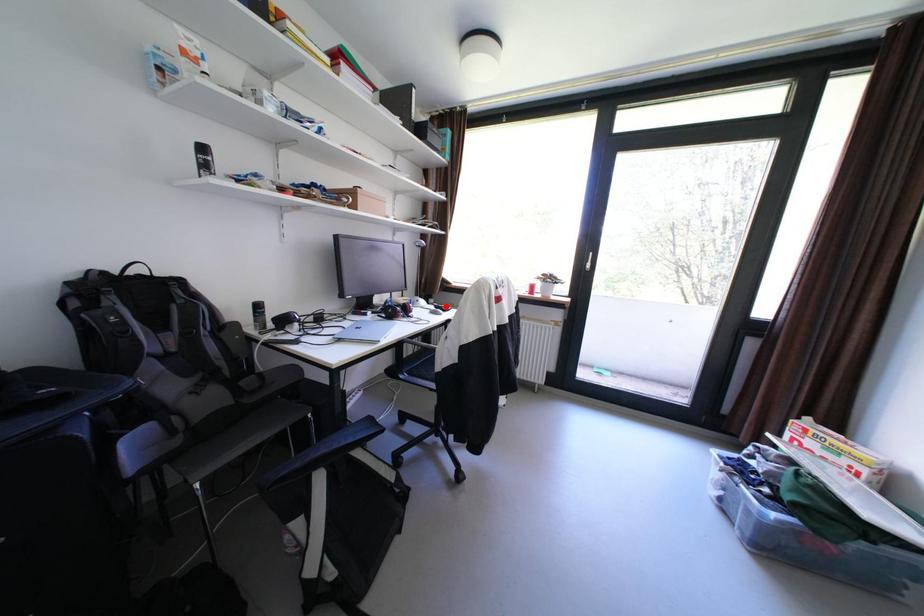
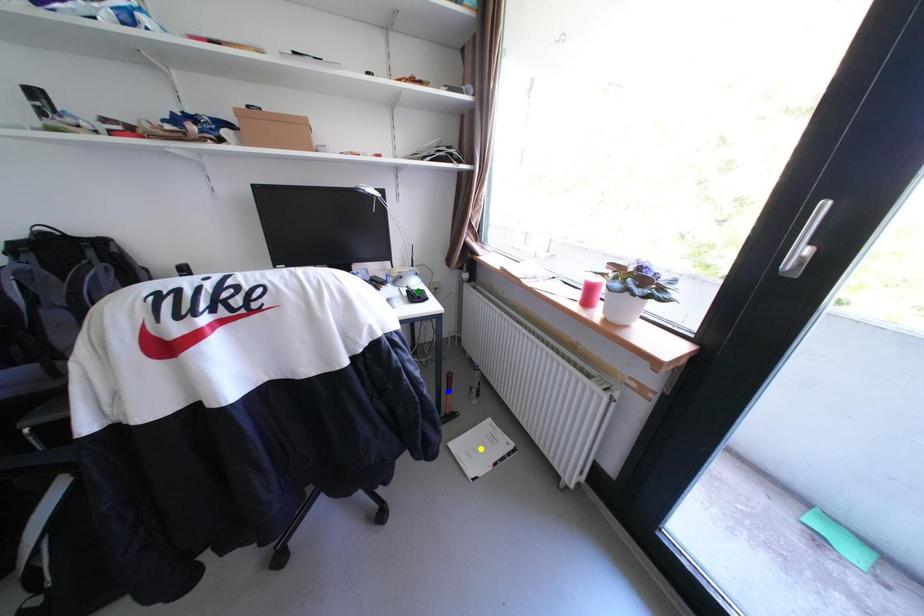
Question: I am providing you with two images of the same scene from different viewpoints. A red point is marked on the first image. You are given multiple points on the second image. In image 2, which mark is for the same physical point as the one in image 1?

Choices:
 (A) yellow point
 (B) green point
 (C) blue point

Answer: (B)